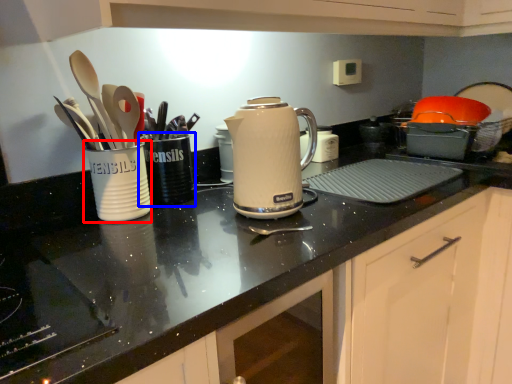
Question: Among these objects, which one is farthest to the camera, tableware (highlighted by a red box) or tableware (highlighted by a blue box)?

Choices:
 (A) tableware
 (B) tableware

Answer: (B)